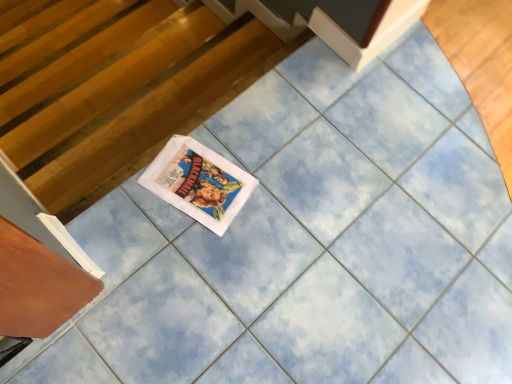
This screenshot has width=512, height=384. Find the location of `vacant space in front of white paper comic book at center`. vacant space in front of white paper comic book at center is located at coordinates (172, 256).